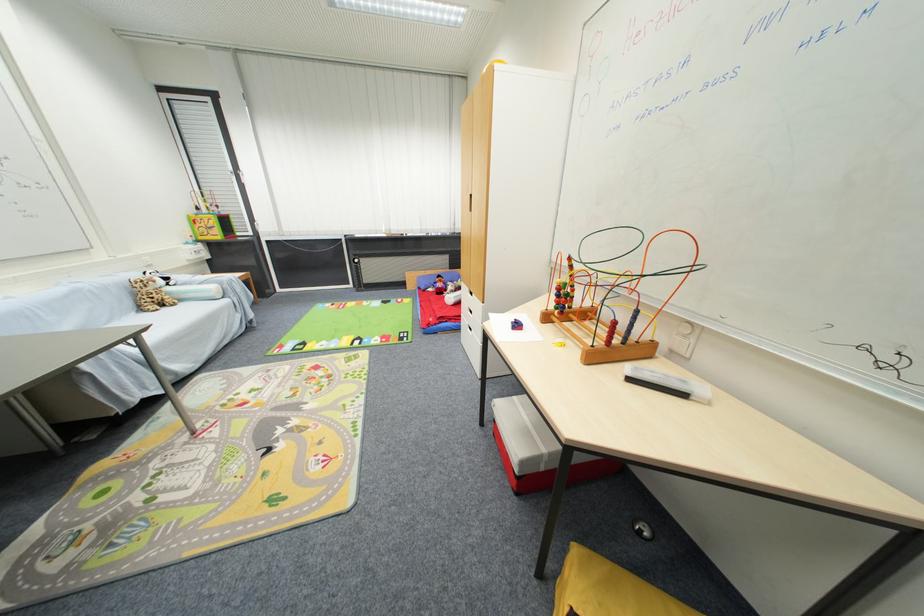
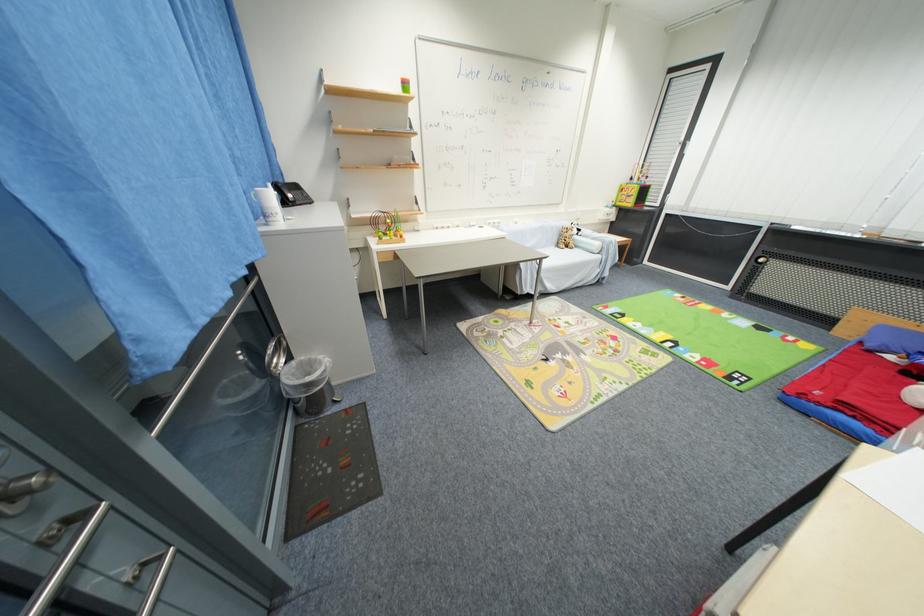
The point at [146,310] is marked in the first image. Where is the corresponding point in the second image?

(563, 246)